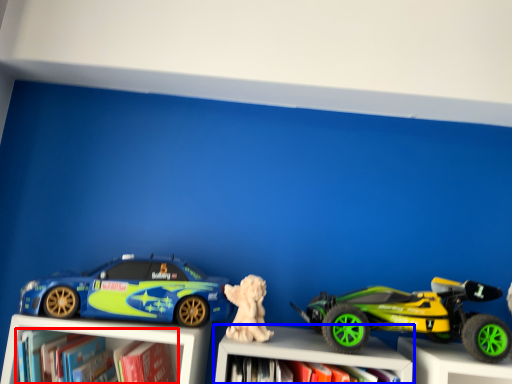
Question: Which object appears farthest to the camera in this image, book (highlighted by a red box) or bookcase (highlighted by a blue box)?

Choices:
 (A) book
 (B) bookcase

Answer: (B)